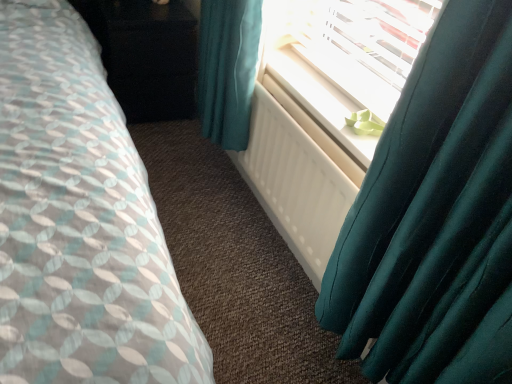
Measure the distance between point (152, 12) and camera.

A distance of 1.86 meters exists between point (152, 12) and camera.

This screenshot has width=512, height=384. In order to click on teal satin curtain at right in this screenshot , I will do `click(435, 216)`.

Image resolution: width=512 pixels, height=384 pixels. In order to click on white matte radiator at center in this screenshot , I will do `click(297, 176)`.

Which is correct: white matte radiator at center is inside teal satin curtain at right, or outside of it?

white matte radiator at center cannot be found inside teal satin curtain at right.

Between white matte radiator at center and teal satin curtain at right, which one has larger width?

teal satin curtain at right.

Measure the distance from white matte radiator at center to teal satin curtain at right.

white matte radiator at center is 42.79 centimeters away from teal satin curtain at right.

Looking at this image, from the image's perspective, is white matte radiator at center positioned above or below teal satin curtain at right?

Clearly, from the image's perspective, white matte radiator at center is above teal satin curtain at right.

Which is more to the left, black glossy dresser at upper left or white matte radiator at center?

black glossy dresser at upper left.

Is black glossy dresser at upper left positioned with its back to white matte radiator at center?

No, black glossy dresser at upper left is not facing away from white matte radiator at center.

In the scene shown: Are black glossy dresser at upper left and white matte radiator at center beside each other?

black glossy dresser at upper left and white matte radiator at center are not in contact.

From the image's perspective, is black glossy dresser at upper left positioned above or below white matte radiator at center?

black glossy dresser at upper left is situated higher than white matte radiator at center in the image.

Who is smaller, white matte radiator at center or black glossy dresser at upper left?

With smaller size is white matte radiator at center.

Does white matte radiator at center have a lesser width compared to black glossy dresser at upper left?

Yes, white matte radiator at center is thinner than black glossy dresser at upper left.

Based on the photo, from the image's perspective, which one is positioned higher, white matte radiator at center or black glossy dresser at upper left?

black glossy dresser at upper left is shown above in the image.

Which object is positioned more to the right, white matte radiator at center or black glossy dresser at upper left?

Positioned to the right is white matte radiator at center.

Is point (504, 167) less distant than point (347, 111)?

Yes, it is in front of point (347, 111).

Is white plastic radiator at upper center at the back of teal satin curtain at right?

teal satin curtain at right does not have its back to white plastic radiator at upper center.

Would you say teal satin curtain at right is a long distance from white plastic radiator at upper center?

No, teal satin curtain at right is in close proximity to white plastic radiator at upper center.

Is teal satin curtain at right taller than white plastic radiator at upper center?

Indeed, teal satin curtain at right has a greater height compared to white plastic radiator at upper center.

From the image's perspective, is white plastic radiator at upper center located beneath black glossy dresser at upper left?

Yes, from the image's perspective, white plastic radiator at upper center is beneath black glossy dresser at upper left.

Is white plastic radiator at upper center wider or thinner than black glossy dresser at upper left?

white plastic radiator at upper center is thinner than black glossy dresser at upper left.

Choose the correct answer: Is black glossy dresser at upper left inside white plastic radiator at upper center or outside it?

black glossy dresser at upper left cannot be found inside white plastic radiator at upper center.

Find the location of a particular element. window sill that is in front of the black glossy dresser at upper left is located at coordinates (320, 101).

Consider the image. Is black glossy dresser at upper left thinner than white plastic radiator at upper center?

No.

Which is nearer, (151,36) or (375,144)?

Clearly, point (151,36) is more distant from the camera than point (375,144).

Is the position of white matte radiator at center less distant than that of white plastic radiator at upper center?

That is True.

Are white matte radiator at center and white plastic radiator at upper center making contact?

No.

In the scene shown: Is white matte radiator at center oriented away from white plastic radiator at upper center?

Yes.

Find the location of `curtain below the white matte radiator at center (from the image's perspective)`. curtain below the white matte radiator at center (from the image's perspective) is located at coordinates (435, 216).

The width and height of the screenshot is (512, 384). Find the location of `dresser above the white matte radiator at center (from the image's perspective)`. dresser above the white matte radiator at center (from the image's perspective) is located at coordinates (146, 56).

Based on their spatial positions, is black glossy dresser at upper left or white plastic radiator at upper center closer to white matte radiator at center?

white plastic radiator at upper center is closer to white matte radiator at center.

Based on their spatial positions, is white plastic radiator at upper center or black glossy dresser at upper left closer to teal satin curtain at right?

white plastic radiator at upper center.

From the image, which object appears to be farther from black glossy dresser at upper left, white plastic radiator at upper center or white matte radiator at center?

white matte radiator at center is further to black glossy dresser at upper left.

Based on their spatial positions, is teal satin curtain at right or white plastic radiator at upper center further from white matte radiator at center?

teal satin curtain at right is positioned further to the anchor white matte radiator at center.

When comparing their distances from teal satin curtain at right, does black glossy dresser at upper left or white plastic radiator at upper center seem closer?

Among the two, white plastic radiator at upper center is located nearer to teal satin curtain at right.

Estimate the real-world distances between objects in this image. Which object is further from white matte radiator at center, teal satin curtain at right or black glossy dresser at upper left?

black glossy dresser at upper left is positioned further to the anchor white matte radiator at center.

Looking at the image, which one is located closer to teal satin curtain at right, white matte radiator at center or black glossy dresser at upper left?

white matte radiator at center is closer to teal satin curtain at right.

Looking at the image, which one is located further to white plastic radiator at upper center, white matte radiator at center or teal satin curtain at right?

teal satin curtain at right is further to white plastic radiator at upper center.

Find the location of a particular element. Image resolution: width=512 pixels, height=384 pixels. radiator located between teal satin curtain at right and black glossy dresser at upper left in the depth direction is located at coordinates (297, 176).

The height and width of the screenshot is (384, 512). In order to click on radiator situated between black glossy dresser at upper left and white plastic radiator at upper center from left to right in this screenshot , I will do `click(297, 176)`.

At what (x,y) coordinates should I click in order to perform the action: click on radiator between teal satin curtain at right and white plastic radiator at upper center in the front-back direction. Please return your answer as a coordinate pair (x, y). Image resolution: width=512 pixels, height=384 pixels. Looking at the image, I should click on (297, 176).

Locate an element on the screen. window sill between teal satin curtain at right and black glossy dresser at upper left in the front-back direction is located at coordinates (320, 101).